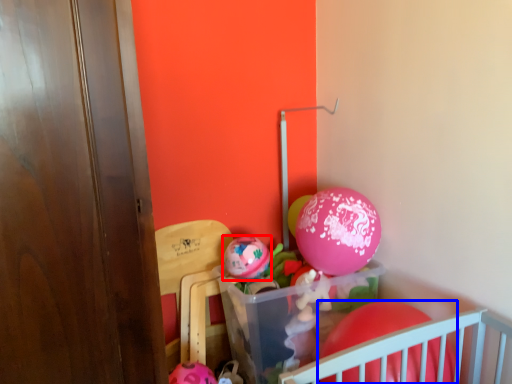
Question: Which object appears farthest to the camera in this image, balloon (highlighted by a red box) or balloon (highlighted by a blue box)?

Choices:
 (A) balloon
 (B) balloon

Answer: (A)